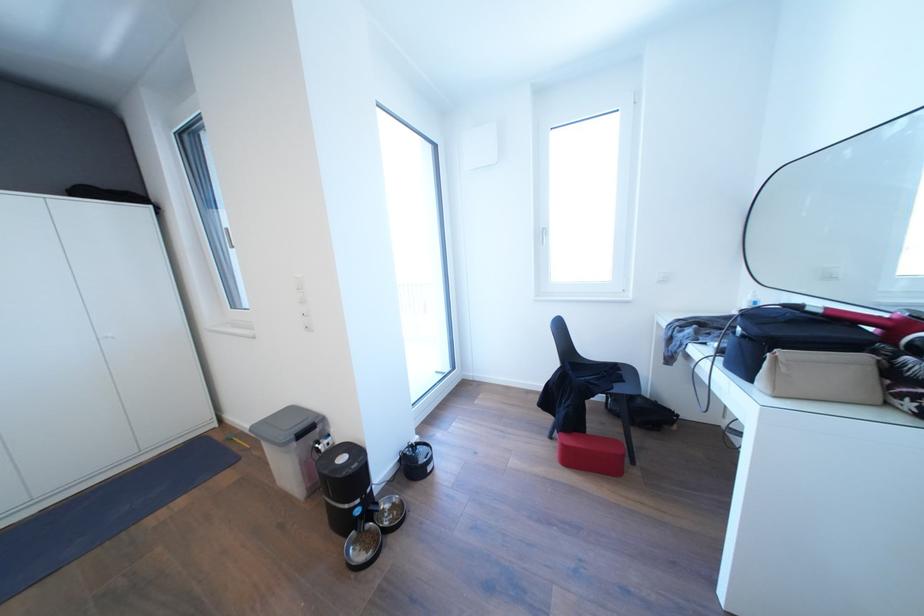
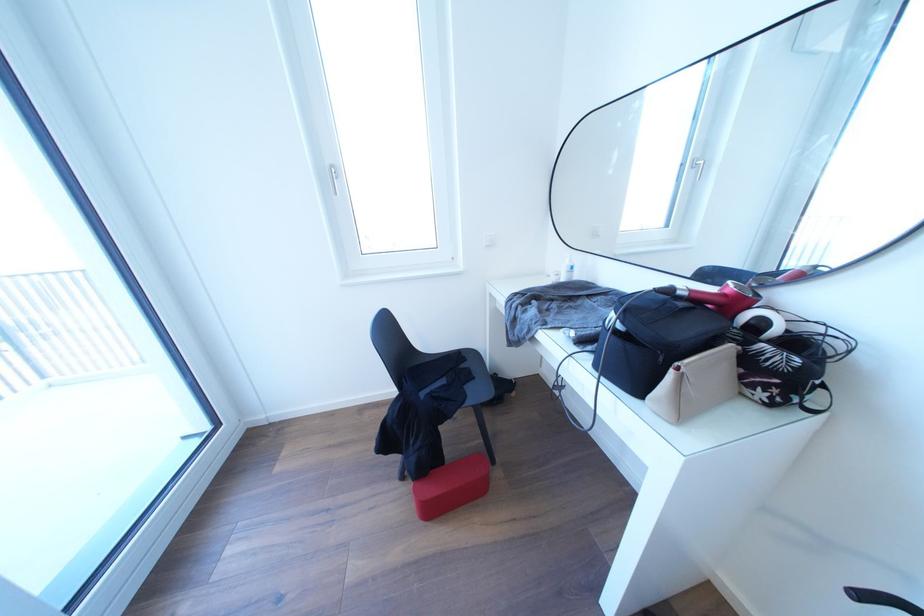
Question: The images are taken continuously from a first-person perspective. In which direction is your viewpoint rotating?

Choices:
 (A) Left
 (B) Right
 (C) Up
 (D) Down

Answer: (B)